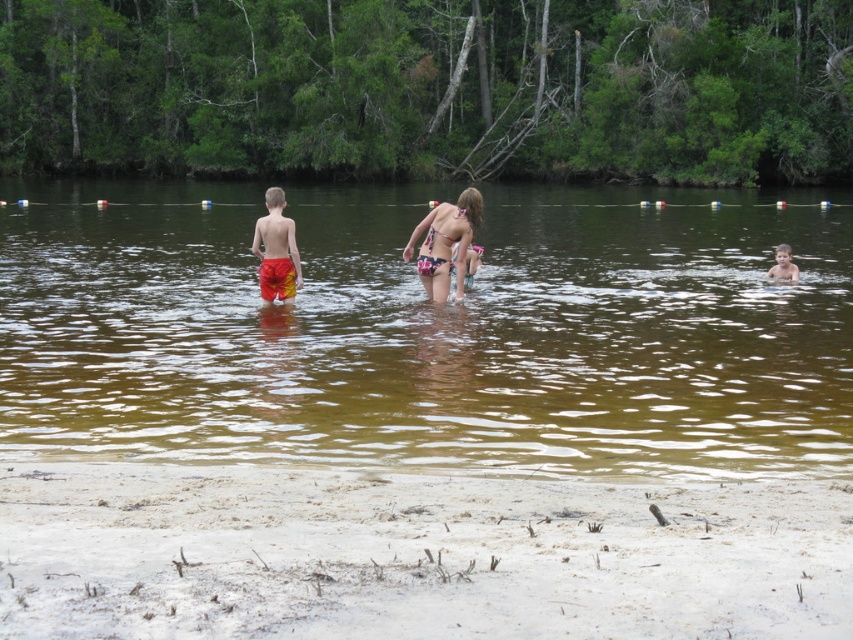
You are a parent watching your children at the beach. You see the brown murky water at center and the printed bikini at center. Which object is closer to you?

The brown murky water at center is closer to you because it is in front of the printed bikini at center.

You are a photographer trying to capture the children in the water. You want to ensure the printed bikini at center and the smooth skin boy at right are both in focus. Which child should you focus on first to make sure both are sharp?

You should focus on the printed bikini at center first because it is above the smooth skin boy at right, so focusing on the closer subject will help both be in focus.